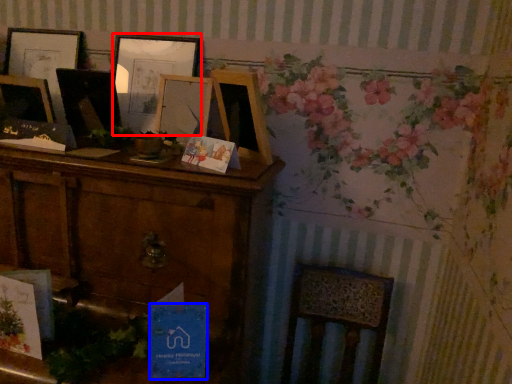
Question: Which of the following is the closest to the observer, picture frame (highlighted by a red box) or postcard (highlighted by a blue box)?

Choices:
 (A) picture frame
 (B) postcard

Answer: (B)